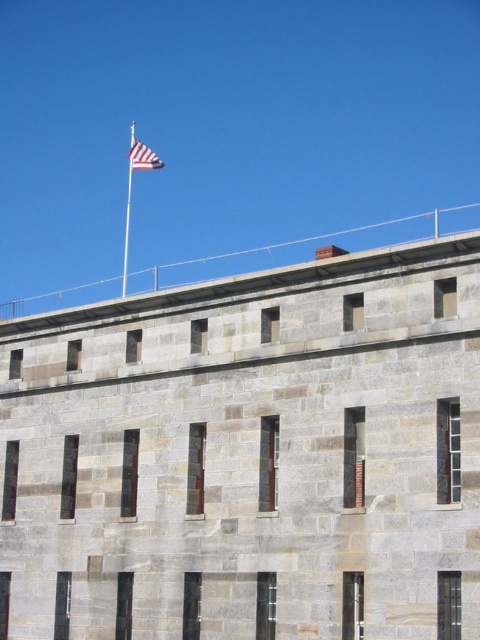
Does polished metal flag pole at upper center appear over striped fabric flag at upper center?

Yes.

Does polished metal flag pole at upper center appear under striped fabric flag at upper center?

No, polished metal flag pole at upper center is not below striped fabric flag at upper center.

Which is in front, point (130, 208) or point (136, 147)?

Point (136, 147)

The height and width of the screenshot is (640, 480). What are the coordinates of `polished metal flag pole at upper center` in the screenshot? It's located at click(128, 209).